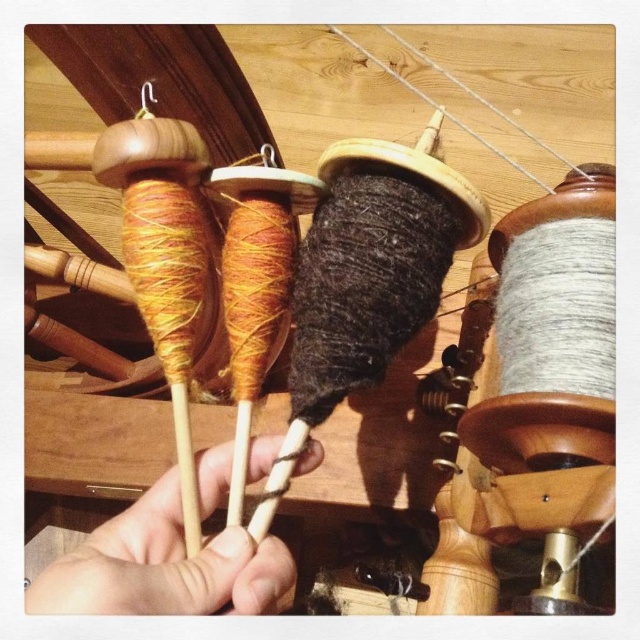
You are a weaver trying to organize your materials. You have a dark woolen yarn at center and matte wood spindles at left. Which object is taller?

The dark woolen yarn at center is taller than the matte wood spindles at left according to the description.

You are a craft maker who needs to place a 30 cm long ruler between the wooden chopsticks at center and the matte wood spindles at left. Will the ruler fit perfectly between them without overlapping either object?

The distance between the wooden chopsticks at center and the matte wood spindles at left is 34.43 centimeters. Since the ruler is only 30 cm long, it will fit perfectly between them with some space to spare.

From the picture: You are holding a pair of wooden chopsticks at center that are 15.69 inches away from you. You want to place them on a table that is 12 inches away. Can you reach the table without moving your hand?

The wooden chopsticks at center are 15.69 inches away from the viewer, which is farther than the table that is 12 inches away. Therefore, you cannot reach the table without moving your hand.